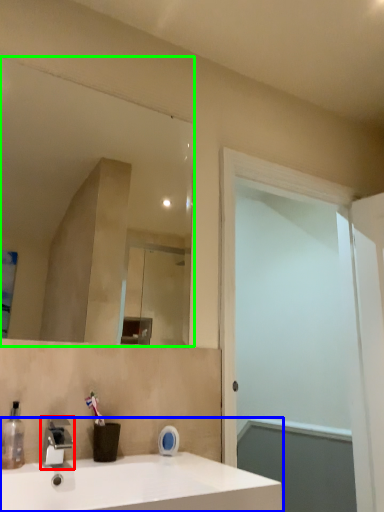
Question: Which is nearer to the tap (highlighted by a red box)? sink (highlighted by a blue box) or mirror (highlighted by a green box).

Choices:
 (A) sink
 (B) mirror

Answer: (A)